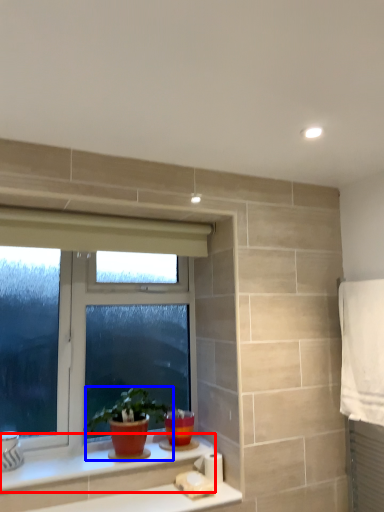
Question: Which object is closer to the camera taking this photo, counter top (highlighted by a red box) or houseplant (highlighted by a blue box)?

Choices:
 (A) counter top
 (B) houseplant

Answer: (A)